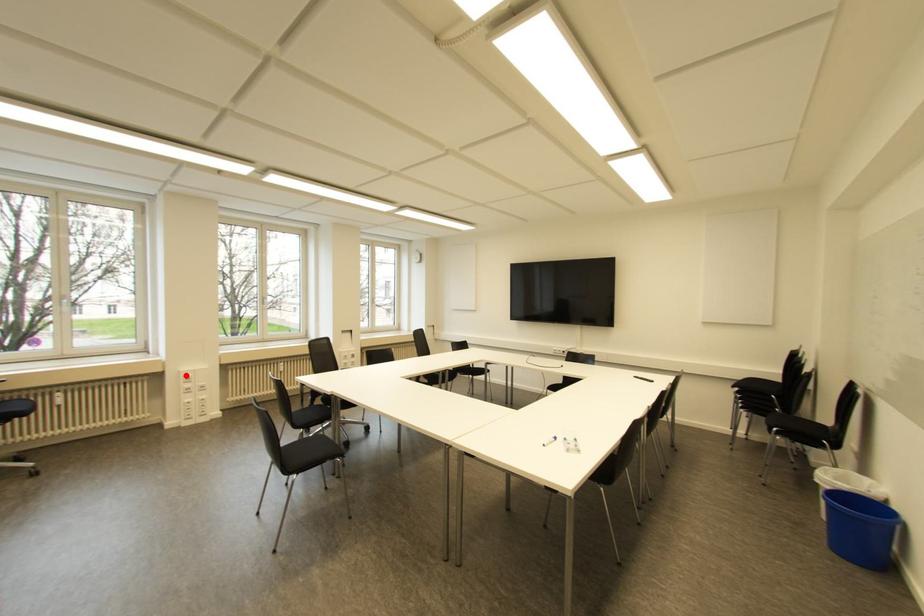
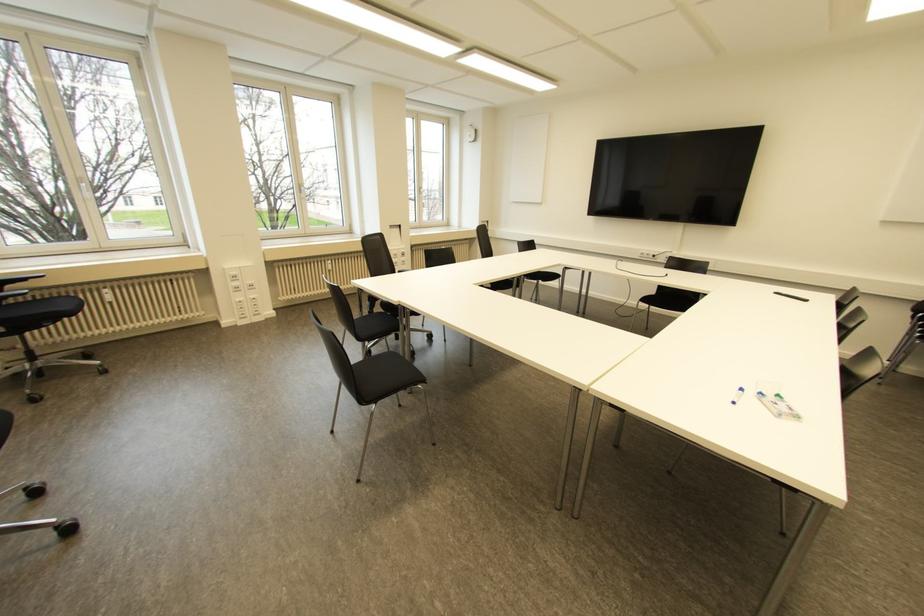
The point at the highlighted location is marked in the first image. Where is the corresponding point in the second image?

(232, 273)